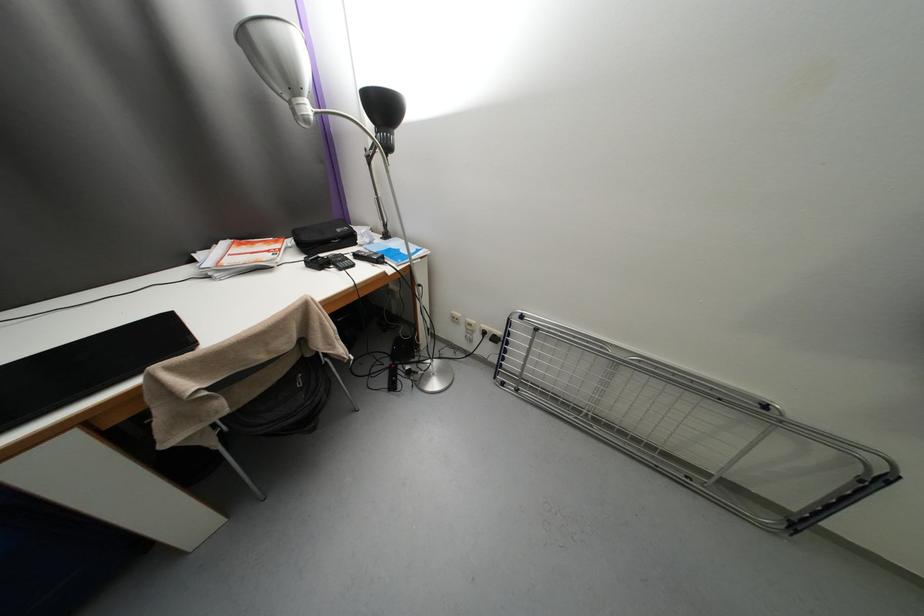
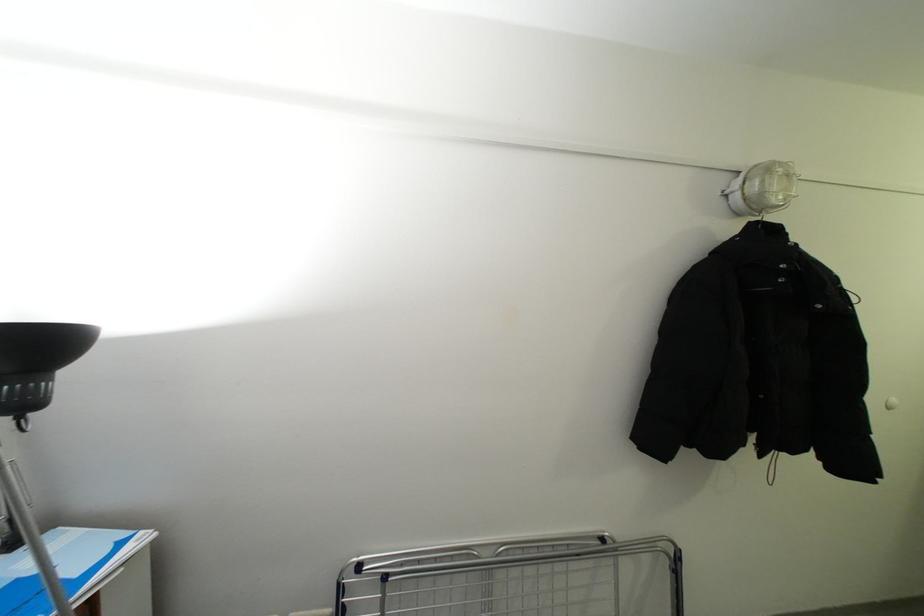
First-person continuous shooting, in which direction is the camera rotating?

The rotation direction of the camera is right-up.